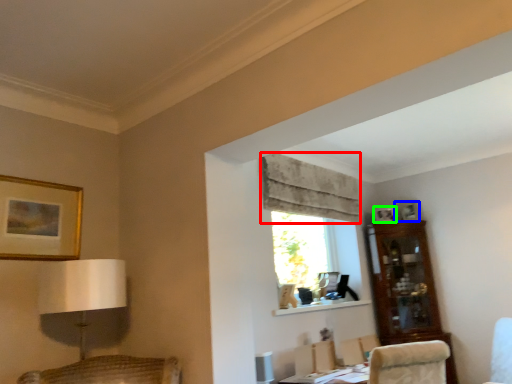
Question: Estimate the real-world distances between objects in this image. Which object is closer to curtain (highlighted by a red box), picture frame (highlighted by a blue box) or picture frame (highlighted by a green box)?

Choices:
 (A) picture frame
 (B) picture frame

Answer: (B)